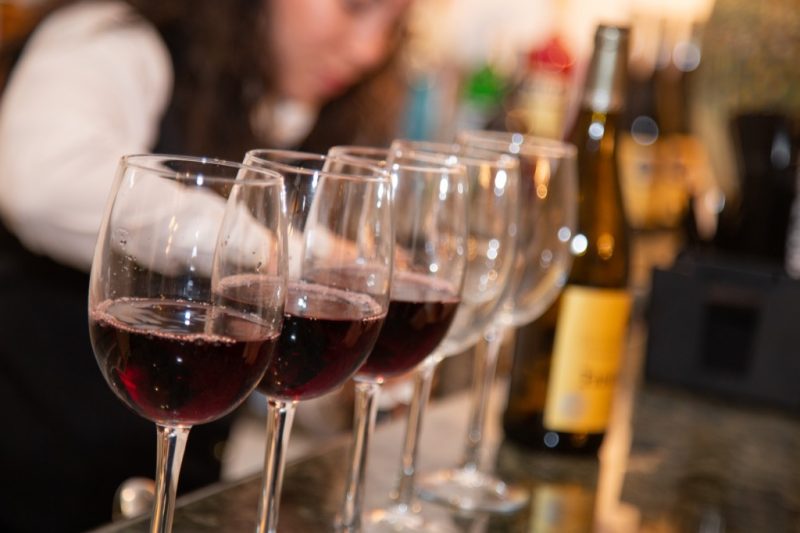
Identify the location of wine glasses. (542, 255), (490, 257), (417, 273), (348, 282), (240, 298).